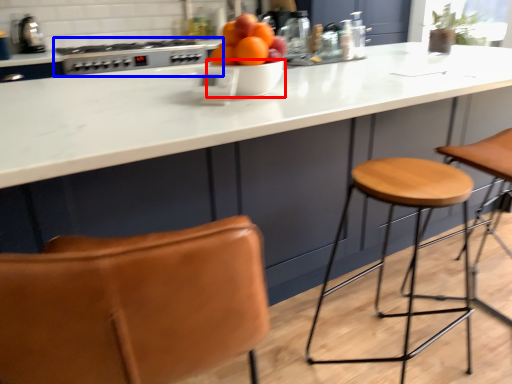
Question: Which point is further to the camera, bowl (highlighted by a red box) or gas stove (highlighted by a blue box)?

Choices:
 (A) bowl
 (B) gas stove

Answer: (B)